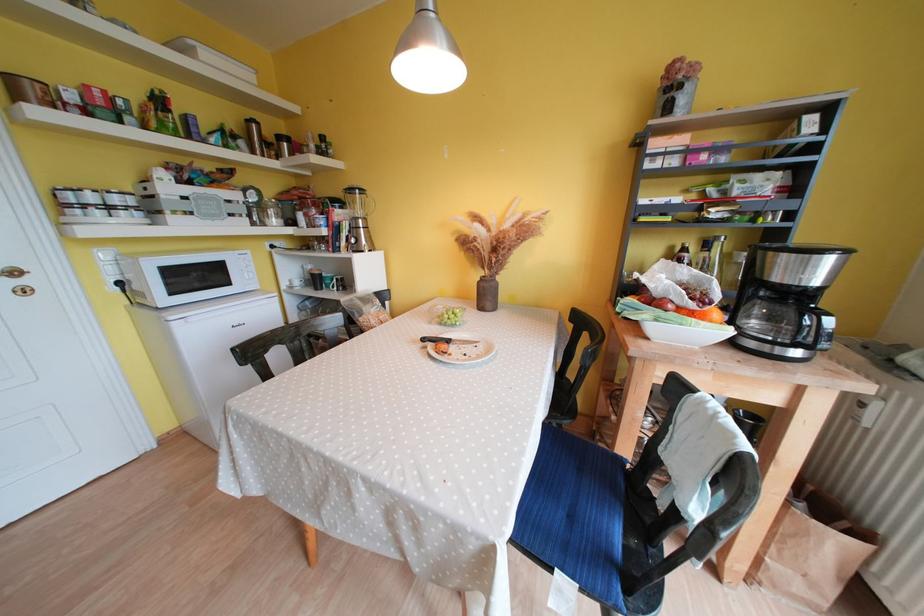
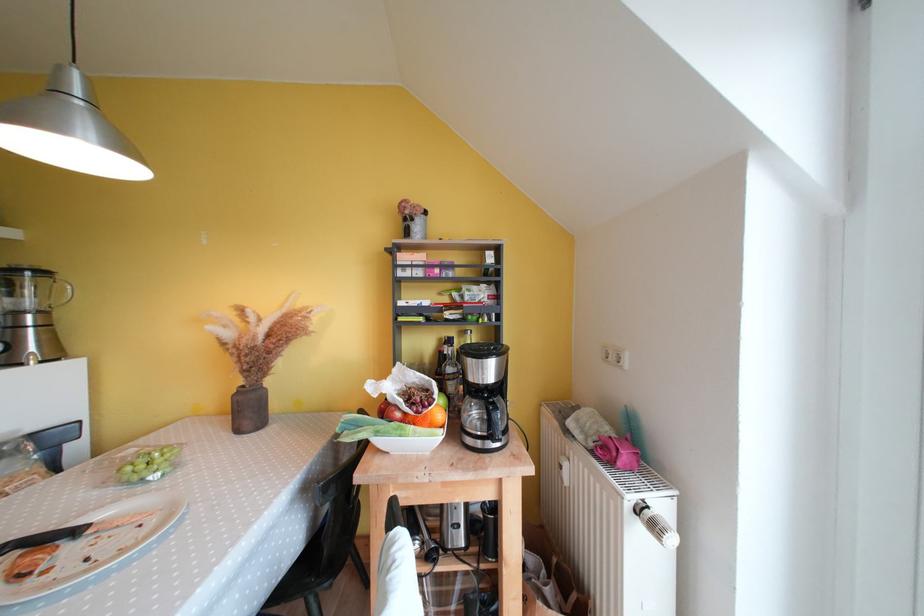
Find the pixel in the second image that matches the point at 659,164 in the first image.

(409, 274)